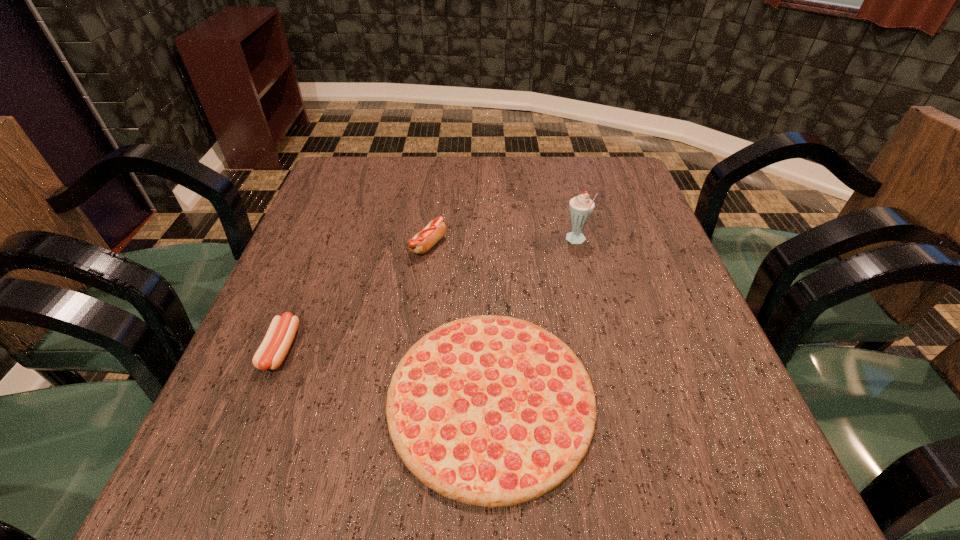
You are a GUI agent. You are given a task and a screenshot of the screen. Output one action in this format:
    pyautogui.click(x=<x>, y=<y>)
    Task: Click on the milkshake
    
    Given the screenshot: What is the action you would take?
    pyautogui.click(x=581, y=207)

This screenshot has height=540, width=960. I want to click on the rightmost object, so click(x=581, y=207).

Locate an element on the screen. This screenshot has width=960, height=540. the taller sausage is located at coordinates (423, 241).

You are a GUI agent. You are given a task and a screenshot of the screen. Output one action in this format:
    pyautogui.click(x=<x>, y=<y>)
    Task: Click on the second tallest object
    This screenshot has height=540, width=960.
    Given the screenshot: What is the action you would take?
    pyautogui.click(x=423, y=241)

Where is `the shorter sausage`? the shorter sausage is located at coordinates (279, 337).

The width and height of the screenshot is (960, 540). Find the location of `the leftmost object`. the leftmost object is located at coordinates (279, 337).

Locate an element on the screen. This screenshot has height=540, width=960. pizza is located at coordinates (492, 411).

This screenshot has height=540, width=960. I want to click on vacant space situated 0.100m on the straw side of the rightmost object, so click(x=522, y=241).

Locate an element on the screen. The height and width of the screenshot is (540, 960). vacant point located on the straw side of the rightmost object is located at coordinates (398, 241).

At what (x,y) coordinates should I click in order to perform the action: click on blank area located on the straw side of the rightmost object. Please return your answer as a coordinate pair (x, y). The image size is (960, 540). Looking at the image, I should click on (462, 241).